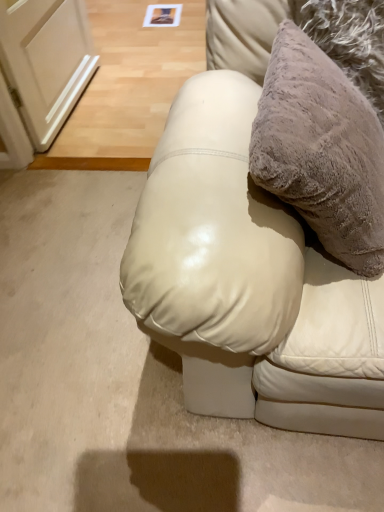
Describe the element at coordinates (321, 150) in the screenshot. The width and height of the screenshot is (384, 512). I see `fuzzy beige pillow at upper right` at that location.

The width and height of the screenshot is (384, 512). I want to click on fuzzy beige pillow at upper right, so 321,150.

Locate an element on the screen. This screenshot has width=384, height=512. leather couch at center is located at coordinates (248, 281).

This screenshot has width=384, height=512. Describe the element at coordinates (248, 281) in the screenshot. I see `leather couch at center` at that location.

Measure the distance between point (x=191, y=289) and camera.

Point (x=191, y=289) is 23.98 inches away from camera.

You are a GUI agent. You are given a task and a screenshot of the screen. Output one action in this format:
    pyautogui.click(x=<x>, y=<y>)
    Task: Click on the fuzzy beige pillow at upper right
    The image size is (384, 512).
    Given the screenshot: What is the action you would take?
    pyautogui.click(x=321, y=150)

Visually, is fuzzy beige pillow at upper right positioned to the left or to the right of leather couch at center?

From the image, it's evident that fuzzy beige pillow at upper right is to the right of leather couch at center.

Does fuzzy beige pillow at upper right lie in front of leather couch at center?

No, fuzzy beige pillow at upper right is further to the viewer.

Which point is more forward, (291, 32) or (235, 242)?

The point (235, 242) is in front.

From the image's perspective, is fuzzy beige pillow at upper right over leather couch at center?

Yes, from the image's perspective, fuzzy beige pillow at upper right is on top of leather couch at center.

From a real-world perspective, is fuzzy beige pillow at upper right under leather couch at center?

No.

Looking at this image, between fuzzy beige pillow at upper right and leather couch at center, which one has larger width?

Wider between the two is leather couch at center.

From the picture: Considering the sizes of fuzzy beige pillow at upper right and leather couch at center in the image, is fuzzy beige pillow at upper right taller or shorter than leather couch at center?

fuzzy beige pillow at upper right is shorter than leather couch at center.

Which of these two, fuzzy beige pillow at upper right or leather couch at center, is smaller?

With smaller size is fuzzy beige pillow at upper right.

Would you say leather couch at center is part of fuzzy beige pillow at upper right's contents?

No, leather couch at center is not inside fuzzy beige pillow at upper right.

Are fuzzy beige pillow at upper right and leather couch at center beside each other?

fuzzy beige pillow at upper right and leather couch at center are not in contact.

Is leather couch at center at the back of fuzzy beige pillow at upper right?

Yes, fuzzy beige pillow at upper right is positioned with its back facing leather couch at center.

Where is `furniture on the left of fuzzy beige pillow at upper right`? furniture on the left of fuzzy beige pillow at upper right is located at coordinates (248, 281).

Is leather couch at center at the right side of fuzzy beige pillow at upper right?

Incorrect, leather couch at center is not on the right side of fuzzy beige pillow at upper right.

Is leather couch at center closer to the viewer compared to fuzzy beige pillow at upper right?

Yes, leather couch at center is closer to the camera.

Which is behind, point (250, 239) or point (317, 50)?

Positioned behind is point (317, 50).

From the image's perspective, is leather couch at center located above or below fuzzy beige pillow at upper right?

Based on their image positions, leather couch at center is located beneath fuzzy beige pillow at upper right.

Consider the image. From a real-world perspective, who is located lower, leather couch at center or fuzzy beige pillow at upper right?

leather couch at center is physically lower.

Considering the sizes of objects leather couch at center and fuzzy beige pillow at upper right in the image provided, who is thinner, leather couch at center or fuzzy beige pillow at upper right?

fuzzy beige pillow at upper right is thinner.

Which of these two, leather couch at center or fuzzy beige pillow at upper right, stands shorter?

Standing shorter between the two is fuzzy beige pillow at upper right.

Considering the sizes of leather couch at center and fuzzy beige pillow at upper right in the image, is leather couch at center bigger or smaller than fuzzy beige pillow at upper right?

leather couch at center is bigger than fuzzy beige pillow at upper right.

Is leather couch at center located outside fuzzy beige pillow at upper right?

That's correct, leather couch at center is outside of fuzzy beige pillow at upper right.

Is leather couch at center not near fuzzy beige pillow at upper right?

leather couch at center is near fuzzy beige pillow at upper right, not far away.

Is leather couch at center facing towards fuzzy beige pillow at upper right?

Yes, leather couch at center is facing fuzzy beige pillow at upper right.

Find the location of a particular element. furniture on the left of the fuzzy beige pillow at upper right is located at coordinates (248, 281).

Image resolution: width=384 pixels, height=512 pixels. In order to click on furniture that is under the fuzzy beige pillow at upper right (from a real-world perspective) in this screenshot , I will do `click(248, 281)`.

Locate an element on the screen. furniture in front of the fuzzy beige pillow at upper right is located at coordinates (248, 281).